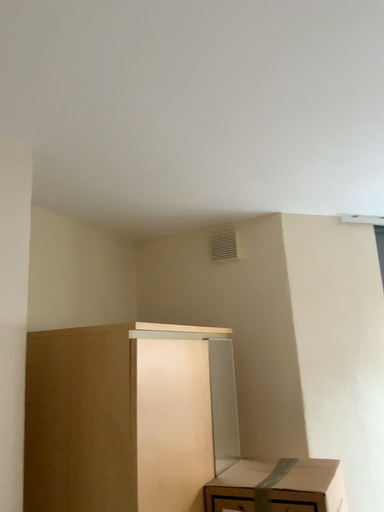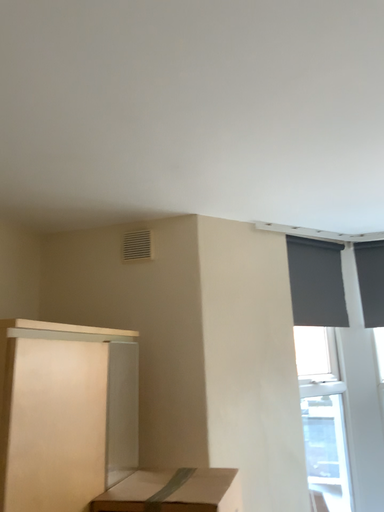
Question: How did the camera likely rotate when shooting the video?

Choices:
 (A) rotated right
 (B) rotated left

Answer: (A)